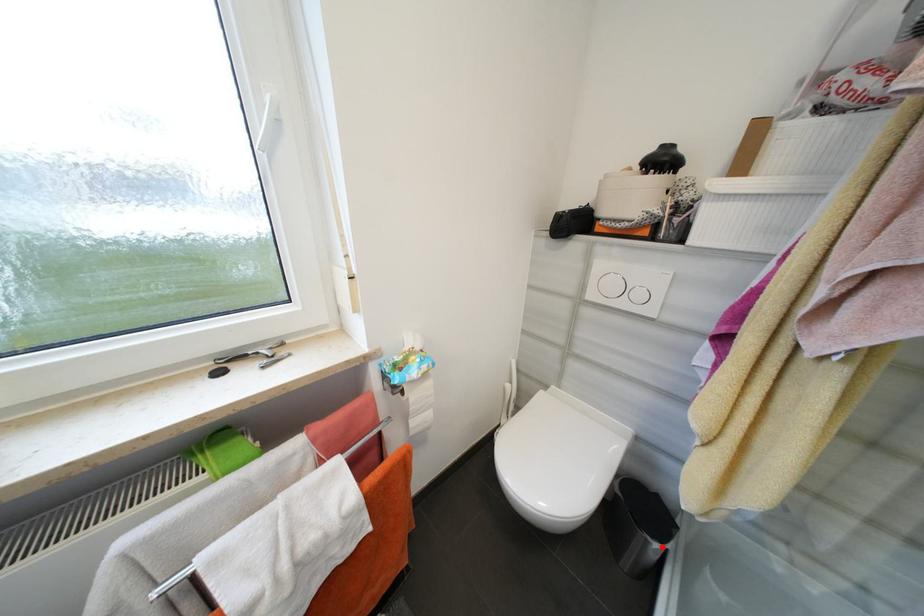
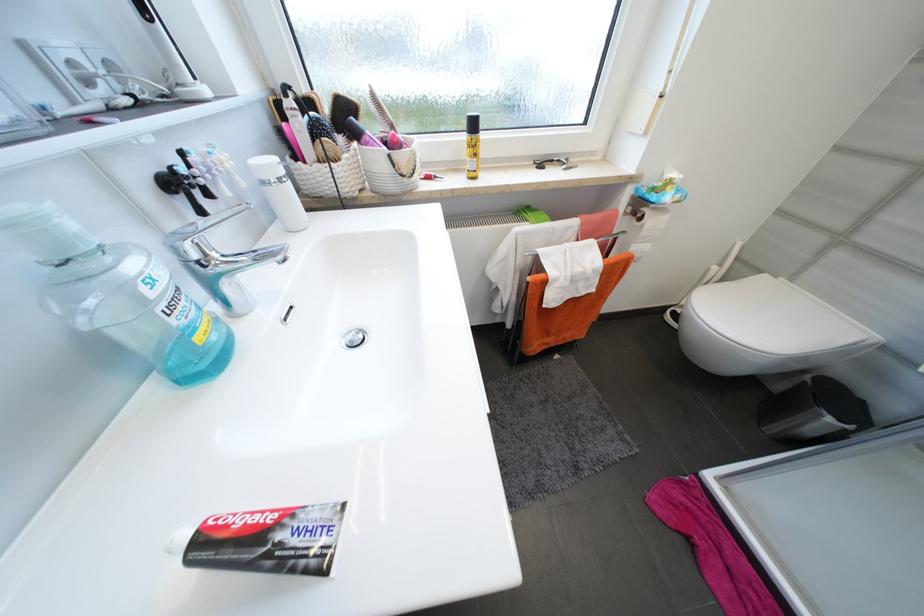
Question: I am providing you with two images of the same scene from different viewpoints. Given a red point in image1, look at the same physical point in image2. Is it:

Choices:
 (A) Closer to the viewpoint
 (B) Farther from the viewpoint

Answer: (A)